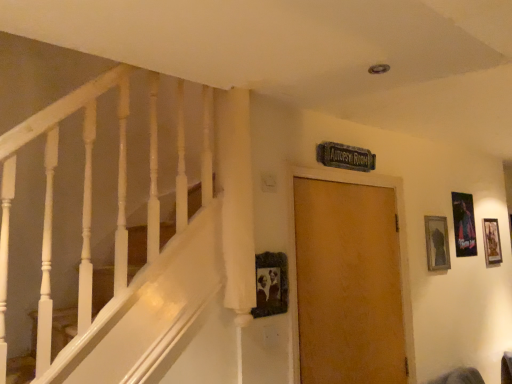
What is the approximate width of metallic silver poster at right, the 2th picture frame from the back?

The width of metallic silver poster at right, the 2th picture frame from the back, is 0.81 inches.

What do you see at coordinates (295, 254) in the screenshot? The image size is (512, 384). I see `wooden door at center` at bounding box center [295, 254].

Consider the image. How much space does metallic gold picture frame at right, arranged as the 4th picture frame when viewed from the front, occupy vertically?

metallic gold picture frame at right, arranged as the 4th picture frame when viewed from the front, is 14.79 inches in height.

The image size is (512, 384). I want to click on wooden photo frame at center, placed as the 1th picture frame when sorted from left to right, so click(271, 284).

Identify the location of matte black picture frame at upper right, the third picture frame viewed from the back. The width and height of the screenshot is (512, 384). (437, 243).

This screenshot has height=384, width=512. In order to click on metallic silver poster at right, the 2th picture frame from the back in this screenshot , I will do pyautogui.click(x=464, y=224).

Are matte black picture frame at upper right, the second picture frame in the front-to-back sequence, and metallic silver poster at right, which is the 3th picture frame in front-to-back order, far apart?

No.

Who is taller, matte black picture frame at upper right, the second picture frame in the front-to-back sequence, or metallic silver poster at right, the 2th picture frame from the back?

metallic silver poster at right, the 2th picture frame from the back, is taller.

From the image's perspective, would you say matte black picture frame at upper right, marked as the 3th picture frame in a right-to-left arrangement, is positioned over metallic silver poster at right, the 2th picture frame from the back?

No, from the image's perspective, matte black picture frame at upper right, marked as the 3th picture frame in a right-to-left arrangement, is not on top of metallic silver poster at right, the 2th picture frame from the back.

In the scene shown: Considering the relative sizes of matte black picture frame at upper right, marked as the 3th picture frame in a right-to-left arrangement, and metallic silver poster at right, the 2th picture frame from the back, in the image provided, is matte black picture frame at upper right, marked as the 3th picture frame in a right-to-left arrangement, bigger than metallic silver poster at right, the 2th picture frame from the back,?

Correct, matte black picture frame at upper right, marked as the 3th picture frame in a right-to-left arrangement, is larger in size than metallic silver poster at right, the 2th picture frame from the back.

Identify the location of door directly beneath the wooden photo frame at center, positioned as the fourth picture frame in back-to-front order (from a real-world perspective). Image resolution: width=512 pixels, height=384 pixels. (295, 254).

Looking at this image, which is correct: wooden photo frame at center, positioned as the fourth picture frame in back-to-front order, is inside wooden door at center, or outside of it?

wooden photo frame at center, positioned as the fourth picture frame in back-to-front order, is not inside wooden door at center, it's outside.

How distant is wooden photo frame at center, acting as the 1th picture frame starting from the front, from metallic gold picture frame at right, which is the 1th picture frame in back-to-front order?

wooden photo frame at center, acting as the 1th picture frame starting from the front, and metallic gold picture frame at right, which is the 1th picture frame in back-to-front order, are 2.18 meters apart from each other.

Considering the points (270, 269) and (490, 255), which point is behind, point (270, 269) or point (490, 255)?

The point (490, 255) is more distant.

From the picture: Relative to metallic gold picture frame at right, which is the 1th picture frame in back-to-front order, is wooden photo frame at center, arranged as the fourth picture frame when viewed from the right, in front or behind?

Visually, wooden photo frame at center, arranged as the fourth picture frame when viewed from the right, is located in front of metallic gold picture frame at right, which is the 1th picture frame in back-to-front order.

Which object is wider, wooden photo frame at center, positioned as the fourth picture frame in back-to-front order, or metallic gold picture frame at right, arranged as the 4th picture frame when viewed from the front?

wooden photo frame at center, positioned as the fourth picture frame in back-to-front order.

Is there a large distance between wooden door at center and wooden photo frame at center, arranged as the fourth picture frame when viewed from the right?

No, wooden door at center is not far away from wooden photo frame at center, arranged as the fourth picture frame when viewed from the right.

Is wooden door at center oriented away from wooden photo frame at center, arranged as the fourth picture frame when viewed from the right?

No, wooden door at center is not facing away from wooden photo frame at center, arranged as the fourth picture frame when viewed from the right.

Is wooden door at center closer to camera compared to wooden photo frame at center, acting as the 1th picture frame starting from the front?

No, the depth of wooden door at center is greater than that of wooden photo frame at center, acting as the 1th picture frame starting from the front.

Considering the positions of objects wooden door at center and wooden photo frame at center, placed as the 1th picture frame when sorted from left to right, in the image provided, who is more to the right, wooden door at center or wooden photo frame at center, placed as the 1th picture frame when sorted from left to right,?

wooden door at center is more to the right.

Consider the image. In terms of width, does matte black picture frame at upper right, marked as the 3th picture frame in a right-to-left arrangement, look wider or thinner when compared to wooden door at center?

In the image, matte black picture frame at upper right, marked as the 3th picture frame in a right-to-left arrangement, appears to be more narrow than wooden door at center.

Looking at this image, from a real-world perspective, is matte black picture frame at upper right, marked as the 3th picture frame in a right-to-left arrangement, above or below wooden door at center?

matte black picture frame at upper right, marked as the 3th picture frame in a right-to-left arrangement, is situated higher than wooden door at center in the real world.

Is point (439, 265) positioned before point (291, 222)?

No.

How many degrees apart are the facing directions of matte black picture frame at upper right, the second picture frame in the front-to-back sequence, and wooden door at center?

matte black picture frame at upper right, the second picture frame in the front-to-back sequence, and wooden door at center are facing 0.00315 degrees away from each other.

You are a GUI agent. You are given a task and a screenshot of the screen. Output one action in this format:
    pyautogui.click(x=<x>, y=<y>)
    Task: Click on the door below the matte black picture frame at upper right, the third picture frame viewed from the back (from the image's perspective)
    The width and height of the screenshot is (512, 384).
    Given the screenshot: What is the action you would take?
    pyautogui.click(x=295, y=254)

Could you tell me if wooden door at center is facing matte black picture frame at upper right, which is counted as the 2th picture frame, starting from the left?

No, wooden door at center is not aimed at matte black picture frame at upper right, which is counted as the 2th picture frame, starting from the left.

Which object is positioned more to the right, wooden door at center or matte black picture frame at upper right, the third picture frame viewed from the back?

From the viewer's perspective, matte black picture frame at upper right, the third picture frame viewed from the back, appears more on the right side.

What's the angular difference between wooden door at center and matte black picture frame at upper right, the third picture frame viewed from the back,'s facing directions?

0.00315 degrees separate the facing orientations of wooden door at center and matte black picture frame at upper right, the third picture frame viewed from the back.

The width and height of the screenshot is (512, 384). Identify the location of the 2nd picture frame to the right of the wooden door at center, starting your count from the anchor. (464, 224).

Consider the image. From a real-world perspective, which is physically below, wooden door at center or metallic silver poster at right, the 2th picture frame from the back?

wooden door at center.

From the image's perspective, is wooden door at center above or below metallic silver poster at right, which is the 3th picture frame in front-to-back order?

Based on their image positions, wooden door at center is located beneath metallic silver poster at right, which is the 3th picture frame in front-to-back order.

Which object is positioned more to the left, wooden door at center or metallic silver poster at right, which is the 2th picture frame from right to left?

wooden door at center is more to the left.

You are a GUI agent. You are given a task and a screenshot of the screen. Output one action in this format:
    pyautogui.click(x=<x>, y=<y>)
    Task: Click on the 1st picture frame below the metallic silver poster at right, which is the 3th picture frame in front-to-back order (from the image's perspective)
    Image resolution: width=512 pixels, height=384 pixels.
    Given the screenshot: What is the action you would take?
    pyautogui.click(x=437, y=243)

This screenshot has width=512, height=384. Identify the location of picture frame on the left of wooden door at center. (271, 284).

Which object lies nearer to the anchor point metallic silver poster at right, which is the 3th picture frame in front-to-back order, wooden photo frame at center, positioned as the fourth picture frame in back-to-front order, or wooden door at center?

wooden door at center is positioned closer to the anchor metallic silver poster at right, which is the 3th picture frame in front-to-back order.

Considering their positions, is wooden door at center positioned further to metallic silver poster at right, the 2th picture frame from the back, than metallic gold picture frame at right, marked as the fourth picture frame in a left-to-right arrangement?

wooden door at center is positioned further to the anchor metallic silver poster at right, the 2th picture frame from the back.

When comparing their distances from wooden door at center, does wooden photo frame at center, placed as the 1th picture frame when sorted from left to right, or matte black picture frame at upper right, which is counted as the 2th picture frame, starting from the left, seem closer?

wooden photo frame at center, placed as the 1th picture frame when sorted from left to right.

Which object lies nearer to the anchor point matte black picture frame at upper right, which is counted as the 2th picture frame, starting from the left, wooden door at center or wooden photo frame at center, acting as the 1th picture frame starting from the front?

wooden door at center is closer to matte black picture frame at upper right, which is counted as the 2th picture frame, starting from the left.

Which object lies nearer to the anchor point wooden photo frame at center, placed as the 1th picture frame when sorted from left to right, matte black picture frame at upper right, the third picture frame viewed from the back, or wooden door at center?

wooden door at center is closer to wooden photo frame at center, placed as the 1th picture frame when sorted from left to right.

From the image, which object appears to be farther from metallic silver poster at right, the 2th picture frame from the back, wooden photo frame at center, placed as the 1th picture frame when sorted from left to right, or metallic gold picture frame at right, marked as the fourth picture frame in a left-to-right arrangement?

wooden photo frame at center, placed as the 1th picture frame when sorted from left to right, is positioned further to the anchor metallic silver poster at right, the 2th picture frame from the back.

Considering their positions, is wooden door at center positioned closer to metallic gold picture frame at right, arranged as the 1th picture frame when viewed from the right, than wooden photo frame at center, placed as the 1th picture frame when sorted from left to right?

wooden door at center lies closer to metallic gold picture frame at right, arranged as the 1th picture frame when viewed from the right, than the other object.

From the image, which object appears to be nearer to matte black picture frame at upper right, the second picture frame in the front-to-back sequence, metallic silver poster at right, the 2th picture frame from the back, or wooden photo frame at center, positioned as the fourth picture frame in back-to-front order?

Based on the image, metallic silver poster at right, the 2th picture frame from the back, appears to be nearer to matte black picture frame at upper right, the second picture frame in the front-to-back sequence.

The width and height of the screenshot is (512, 384). Identify the location of door between wooden photo frame at center, arranged as the fourth picture frame when viewed from the right, and matte black picture frame at upper right, the third picture frame viewed from the back, from left to right. (295, 254).

The height and width of the screenshot is (384, 512). I want to click on picture frame between wooden photo frame at center, arranged as the fourth picture frame when viewed from the right, and metallic silver poster at right, which is the 3th picture frame in front-to-back order, so click(437, 243).

In order to click on door between wooden photo frame at center, positioned as the fourth picture frame in back-to-front order, and metallic gold picture frame at right, marked as the fourth picture frame in a left-to-right arrangement, from left to right in this screenshot , I will do `click(295, 254)`.

Where is `door located between wooden photo frame at center, placed as the 1th picture frame when sorted from left to right, and metallic silver poster at right, which ranks as the third picture frame in left-to-right order, in the left-right direction`? This screenshot has width=512, height=384. door located between wooden photo frame at center, placed as the 1th picture frame when sorted from left to right, and metallic silver poster at right, which ranks as the third picture frame in left-to-right order, in the left-right direction is located at coordinates (295, 254).